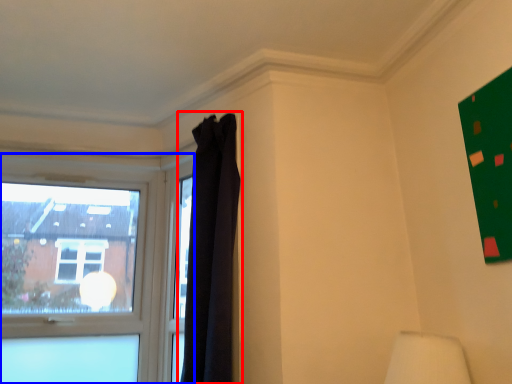
Question: Among these objects, which one is farthest to the camera, curtain (highlighted by a red box) or window (highlighted by a blue box)?

Choices:
 (A) curtain
 (B) window

Answer: (B)